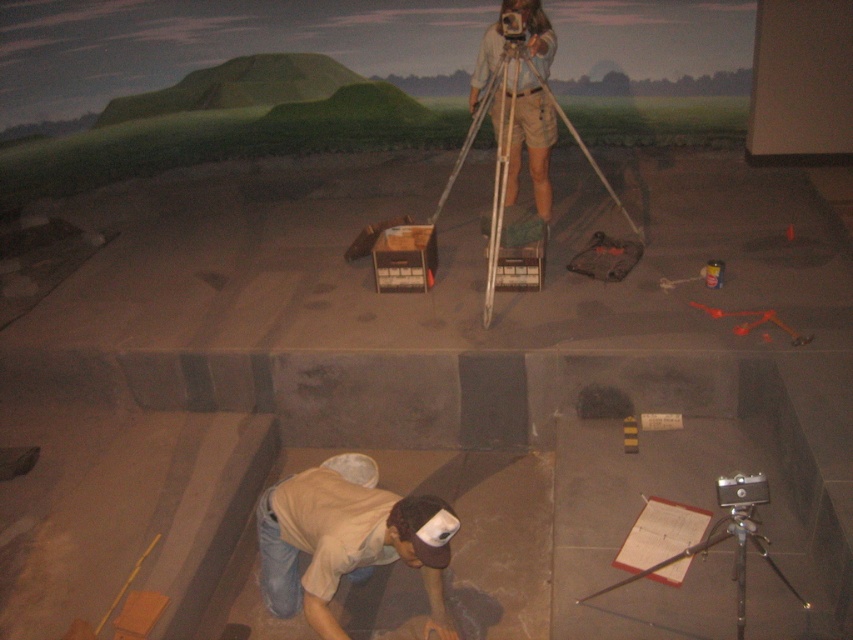
Question: Is wooden tripod at center positioned at the back of silver metallic camera at lower right?

Choices:
 (A) yes
 (B) no

Answer: (A)

Question: From the image, what is the correct spatial relationship of brown cotton shirt at lower center in relation to silver metallic tripod at upper center?

Choices:
 (A) above
 (B) below

Answer: (B)

Question: Among these objects, which one is farthest from the camera?

Choices:
 (A) silver metallic camera at lower right
 (B) matte khaki shorts at center
 (C) wooden tripod at center
 (D) brown cotton shirt at lower center

Answer: (B)

Question: Among these points, which one is nearest to the camera?

Choices:
 (A) (505, 60)
 (B) (756, 492)
 (C) (427, 582)

Answer: (B)

Question: Among these objects, which one is nearest to the camera?

Choices:
 (A) brown cotton shirt at lower center
 (B) silver metallic tripod at lower right
 (C) silver metallic camera at lower right
 (D) matte khaki shorts at center

Answer: (C)

Question: Is brown cotton shirt at lower center wider than silver metallic camera at lower right?

Choices:
 (A) yes
 (B) no

Answer: (A)